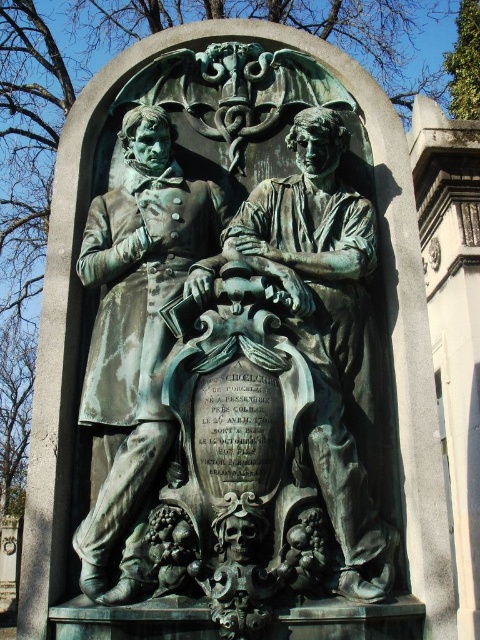
Is bronze statue at center taller than green patina statue at left?

Yes.

Can you confirm if bronze statue at center is wider than green patina statue at left?

Yes, bronze statue at center is wider than green patina statue at left.

The width and height of the screenshot is (480, 640). What do you see at coordinates (237, 344) in the screenshot?
I see `bronze statue at center` at bounding box center [237, 344].

Find the location of `bronze statue at center`. bronze statue at center is located at coordinates (237, 344).